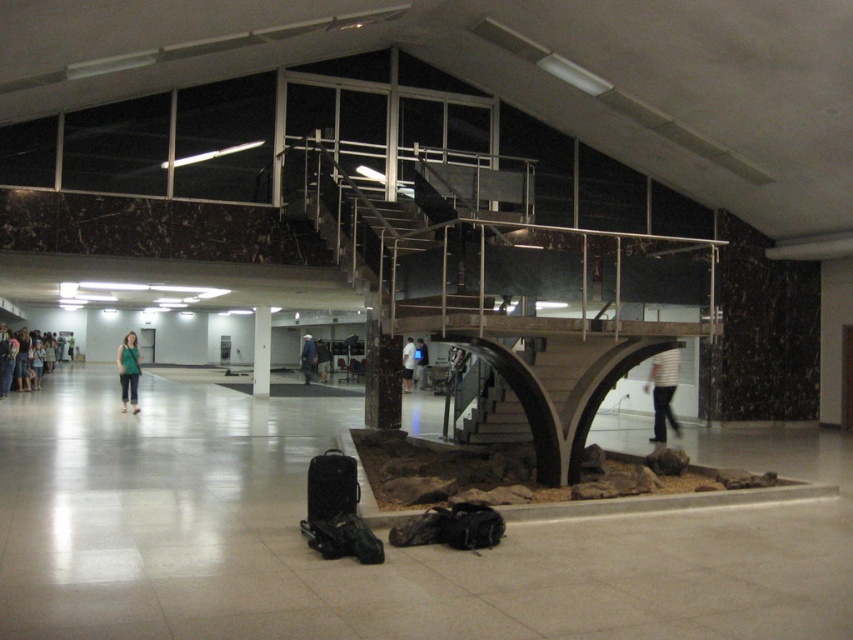
Question: Can you confirm if blue denim jeans at center is positioned above white shirt at center?

Choices:
 (A) no
 (B) yes

Answer: (A)

Question: Does white marble pillar at center appear on the right side of blue denim jeans at center?

Choices:
 (A) no
 (B) yes

Answer: (A)

Question: Which object appears farthest from the camera in this image?

Choices:
 (A) white matte shirt at center
 (B) white shirt at center
 (C) green fabric dress at left
 (D) white marble pillar at center

Answer: (A)

Question: Which object is positioned farthest from the white matte shirt at center?

Choices:
 (A) white striped shirt at center
 (B) green fabric shirt at center
 (C) blue denim jeans at center

Answer: (A)

Question: Where is green fabric shirt at center located in relation to white shirt at center in the image?

Choices:
 (A) left
 (B) right

Answer: (A)

Question: Among these points, which one is farthest from the camera?

Choices:
 (A) (660, 404)
 (B) (424, 362)
 (C) (309, 360)

Answer: (C)